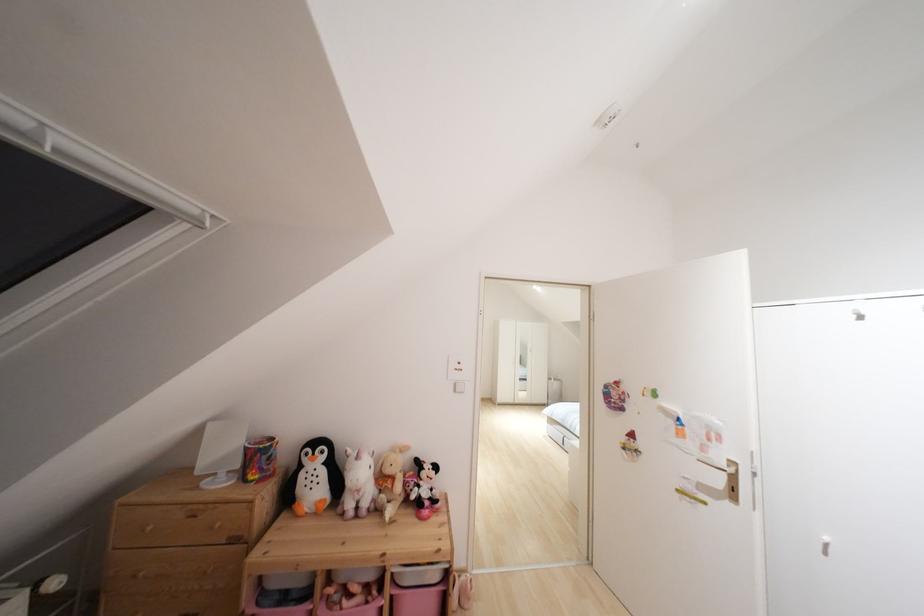
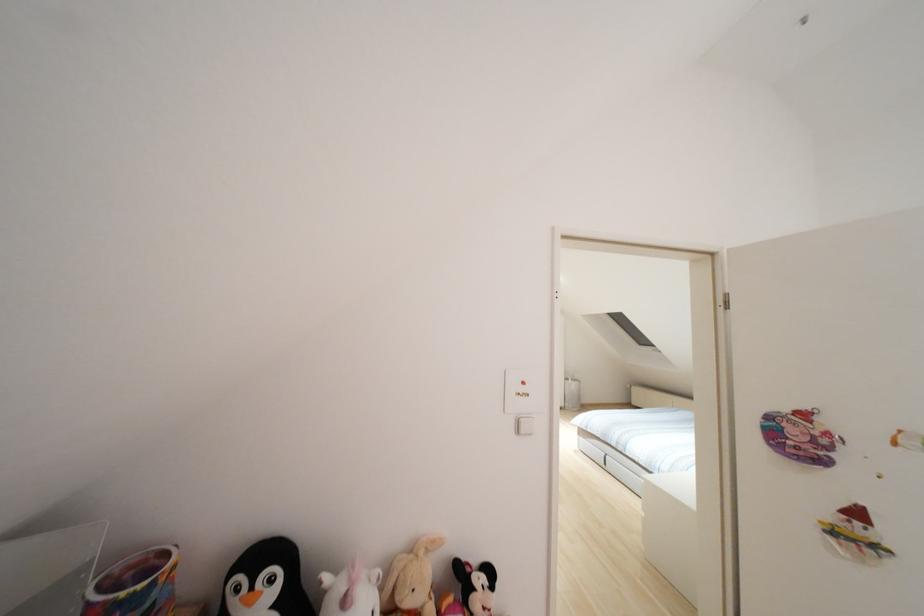
Question: The camera is either moving clockwise (left) or counter-clockwise (right) around the object. The first image is from the beginning of the video and the second image is from the end. Is the camera moving left or right when shooting the video?

Choices:
 (A) Left
 (B) Right

Answer: (A)